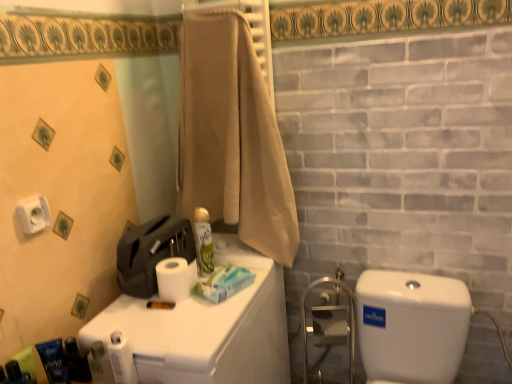
Question: Can you confirm if blue matte tube at lower left, positioned as the second toiletry in front-to-back order, is bigger than green matte spray can at center, positioned as the fifth toiletry in front-to-back order?

Choices:
 (A) yes
 (B) no

Answer: (B)

Question: Is the surface of blue matte tube at lower left, which is the 2th toiletry in left-to-right order, in direct contact with green matte spray can at center, placed as the first toiletry when sorted from back to front?

Choices:
 (A) no
 (B) yes

Answer: (A)

Question: Does blue matte tube at lower left, the 4th toiletry from the back, have a greater height compared to green matte spray can at center, the fifth toiletry when ordered from left to right?

Choices:
 (A) yes
 (B) no

Answer: (B)

Question: Is blue matte tube at lower left, the fourth toiletry from the right, smaller than green matte spray can at center, the fifth toiletry when ordered from left to right?

Choices:
 (A) yes
 (B) no

Answer: (A)

Question: Does blue matte tube at lower left, the 4th toiletry from the back, turn towards green matte spray can at center, placed as the first toiletry when sorted from back to front?

Choices:
 (A) no
 (B) yes

Answer: (A)

Question: Considering their positions, is black plastic razor at lower left, the fifth toiletry positioned from the right, located in front of or behind metallic blue soap dispenser at lower left, the 2th toiletry from the back?

Choices:
 (A) behind
 (B) front

Answer: (B)

Question: From the image's perspective, is black plastic razor at lower left, acting as the 1th toiletry starting from the front, above or below metallic blue soap dispenser at lower left, the 4th toiletry in the front-to-back sequence?

Choices:
 (A) below
 (B) above

Answer: (A)

Question: In the image, is black plastic razor at lower left, acting as the 1th toiletry starting from the front, on the left side or the right side of metallic blue soap dispenser at lower left, the 4th toiletry in the front-to-back sequence?

Choices:
 (A) left
 (B) right

Answer: (A)

Question: In terms of width, does black plastic razor at lower left, marked as the 5th toiletry in a back-to-front arrangement, look wider or thinner when compared to metallic blue soap dispenser at lower left, the 2th toiletry from the back?

Choices:
 (A) thin
 (B) wide

Answer: (A)

Question: Does point (79, 352) appear closer or farther from the camera than point (203, 256)?

Choices:
 (A) closer
 (B) farther

Answer: (A)

Question: Is metallic blue soap dispenser at lower left, the fourth toiletry in the left-to-right sequence, spatially inside green matte spray can at center, positioned as the fifth toiletry in front-to-back order, or outside of it?

Choices:
 (A) outside
 (B) inside

Answer: (A)

Question: In terms of width, does metallic blue soap dispenser at lower left, the fourth toiletry in the left-to-right sequence, look wider or thinner when compared to green matte spray can at center, positioned as the fifth toiletry in front-to-back order?

Choices:
 (A) wide
 (B) thin

Answer: (B)

Question: From the image's perspective, is metallic blue soap dispenser at lower left, the 2th toiletry when ordered from right to left, above or below green matte spray can at center, positioned as the fifth toiletry in front-to-back order?

Choices:
 (A) above
 (B) below

Answer: (B)

Question: In terms of height, does blue matte toiletry at lower left, the 3th toiletry positioned from the front, look taller or shorter compared to metallic blue soap dispenser at lower left, the fourth toiletry in the left-to-right sequence?

Choices:
 (A) short
 (B) tall

Answer: (B)

Question: Based on their sizes in the image, would you say blue matte toiletry at lower left, the third toiletry when ordered from right to left, is bigger or smaller than metallic blue soap dispenser at lower left, the 4th toiletry in the front-to-back sequence?

Choices:
 (A) big
 (B) small

Answer: (B)